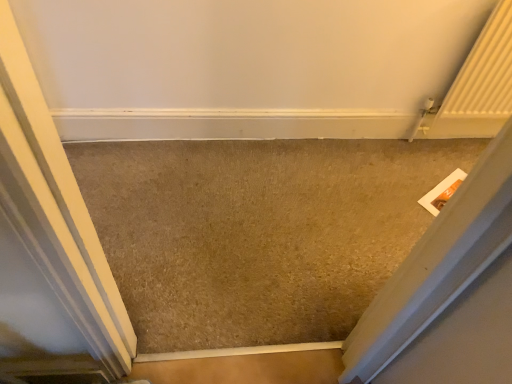
Question: Considering the relative sizes of white matte door at left and beige carpet at center in the image provided, is white matte door at left bigger than beige carpet at center?

Choices:
 (A) yes
 (B) no

Answer: (A)

Question: Is white matte door at left beside beige carpet at center?

Choices:
 (A) yes
 (B) no

Answer: (B)

Question: Is white matte door at left thinner than beige carpet at center?

Choices:
 (A) yes
 (B) no

Answer: (A)

Question: Is white matte door at left far from beige carpet at center?

Choices:
 (A) yes
 (B) no

Answer: (B)

Question: Is white matte door at left behind beige carpet at center?

Choices:
 (A) yes
 (B) no

Answer: (B)

Question: From a real-world perspective, is white matte door at left on beige carpet at center?

Choices:
 (A) no
 (B) yes

Answer: (B)

Question: From a real-world perspective, is beige carpet at center located higher than white matte door at left?

Choices:
 (A) yes
 (B) no

Answer: (B)

Question: Are beige carpet at center and white matte door at left making contact?

Choices:
 (A) yes
 (B) no

Answer: (B)

Question: Does beige carpet at center contain white matte door at left?

Choices:
 (A) no
 (B) yes

Answer: (A)

Question: Can you confirm if beige carpet at center is wider than white matte door at left?

Choices:
 (A) no
 (B) yes

Answer: (B)

Question: Does beige carpet at center appear on the left side of white matte door at left?

Choices:
 (A) no
 (B) yes

Answer: (A)

Question: Is the depth of beige carpet at center less than that of white matte door at left?

Choices:
 (A) no
 (B) yes

Answer: (A)

Question: Is beige carpet at center in front of or behind white matte door at left in the image?

Choices:
 (A) front
 (B) behind

Answer: (B)